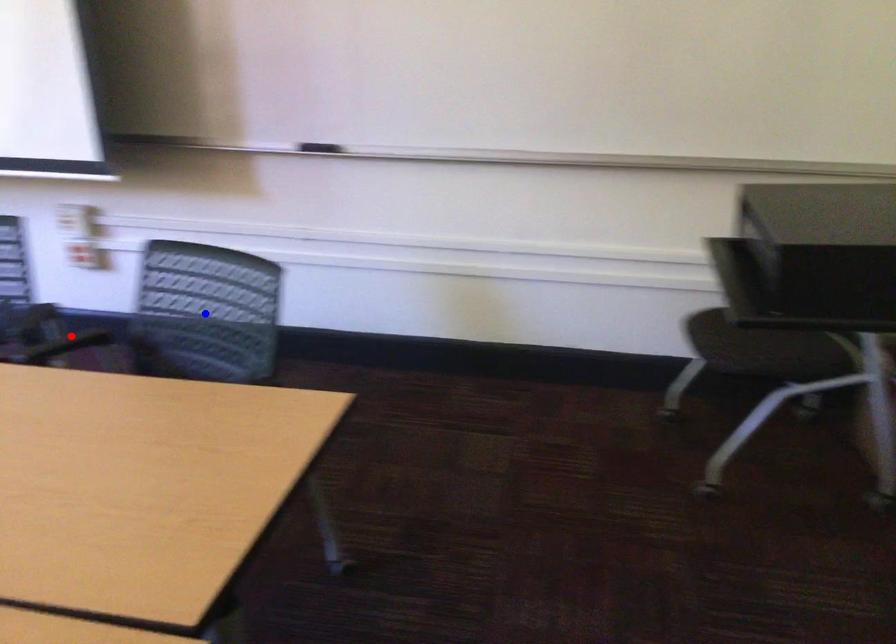
Question: Which of the two points in the image is closer to the camera?

Choices:
 (A) Blue point is closer.
 (B) Red point is closer.

Answer: (B)